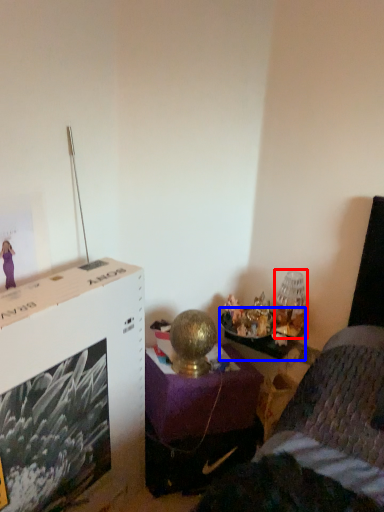
Question: Which object is further to the camera taking this photo, table lamp (highlighted by a red box) or table (highlighted by a blue box)?

Choices:
 (A) table lamp
 (B) table

Answer: (A)